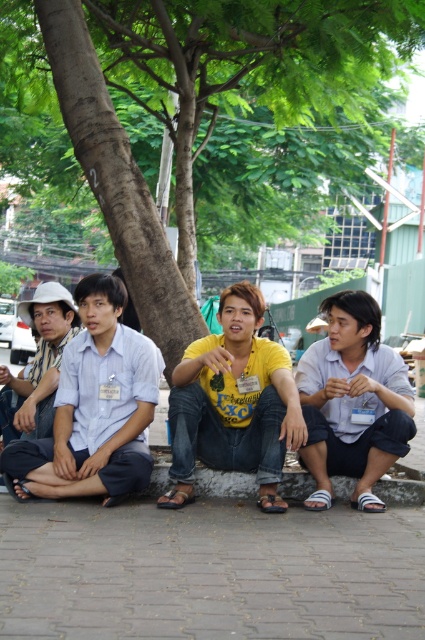
You are standing in the park and see the brown rough tree trunk at center. If you walk straight towards it for 5 meters, will you reach the tree trunk?

The brown rough tree trunk at center is 5.67 meters away from the viewer. After walking 5 meters, you will still be 0.67 meters away from the tree trunk, so you have not reached it yet.

You are standing at the center of the image. Which direction should you move to get closer to the brown rough tree trunk at center?

The brown rough tree trunk at center is located at point 0.158 on the x axis and 0.435 on the y axis. Since you are at the center of the image, which is point 0.5 on both axes, you should move left and down to reach the brown rough tree trunk at center.

You are a painter who wants to paint the brown rough tree trunk at center and the yellow matte shirt at center. If you use the same brush size for both, which object will require more strokes to cover its width?

The brown rough tree trunk at center requires more strokes to cover its width because its width is larger than the yellow matte shirt at center.